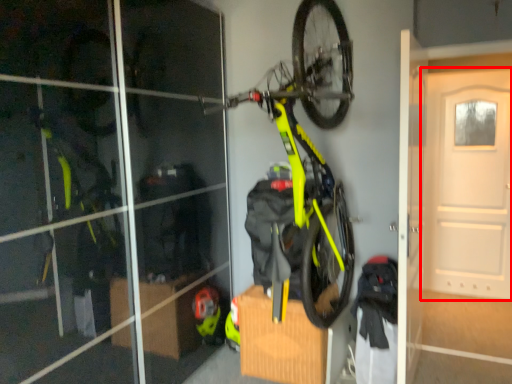
Question: Observing the image, what is the correct spatial positioning of door (annotated by the red box) in reference to bicycle?

Choices:
 (A) left
 (B) right

Answer: (B)